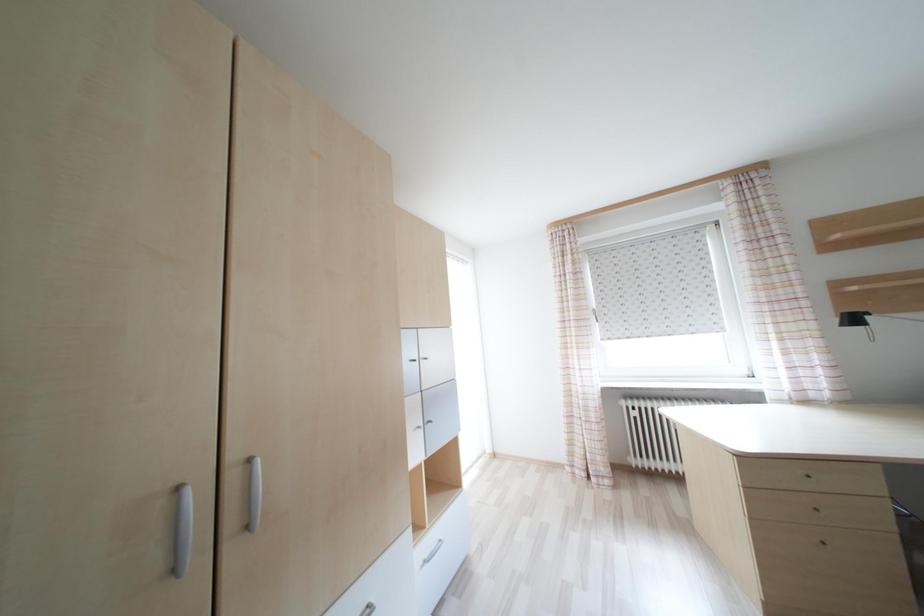
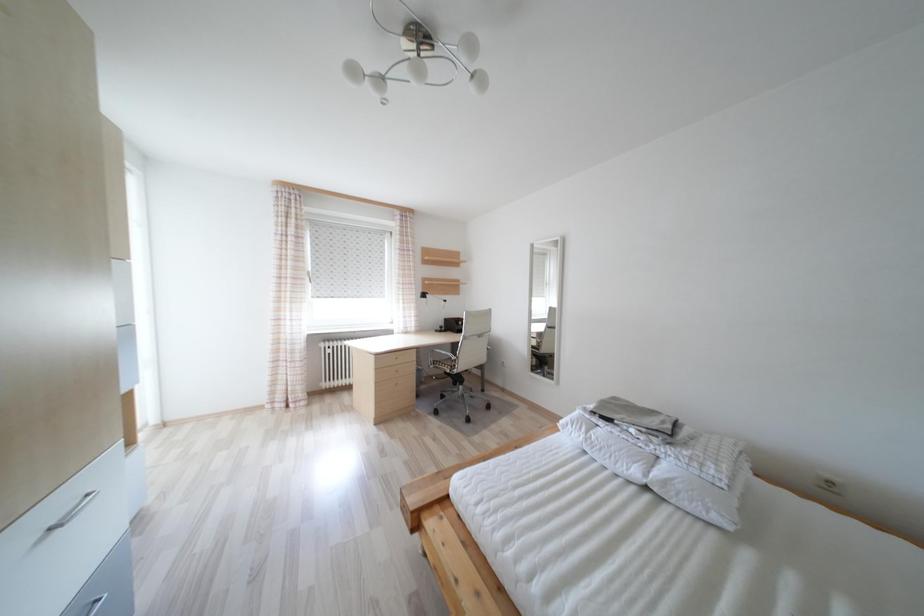
Question: The camera is either moving clockwise (left) or counter-clockwise (right) around the object. The first image is from the beginning of the video and the second image is from the end. Is the camera moving left or right when shooting the video?

Choices:
 (A) Left
 (B) Right

Answer: (A)